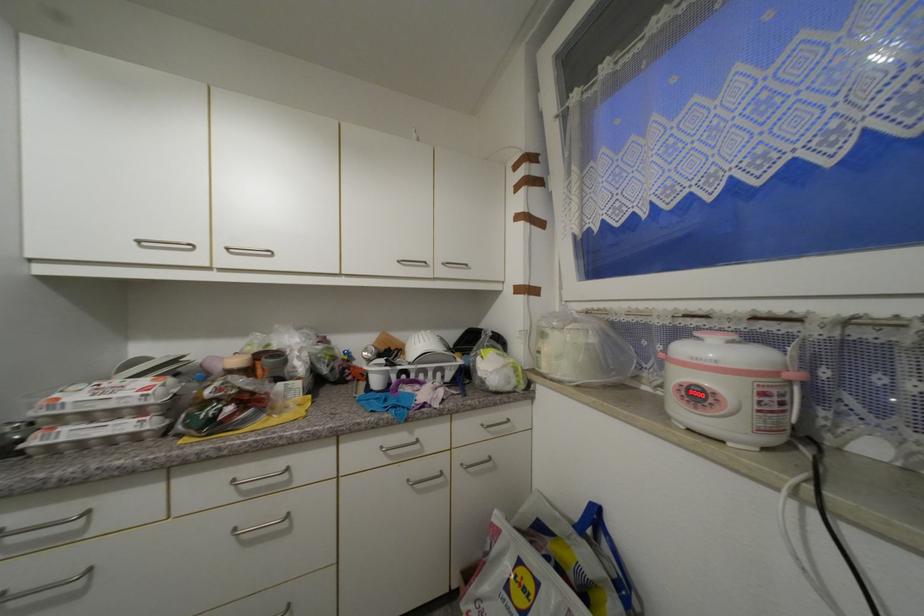
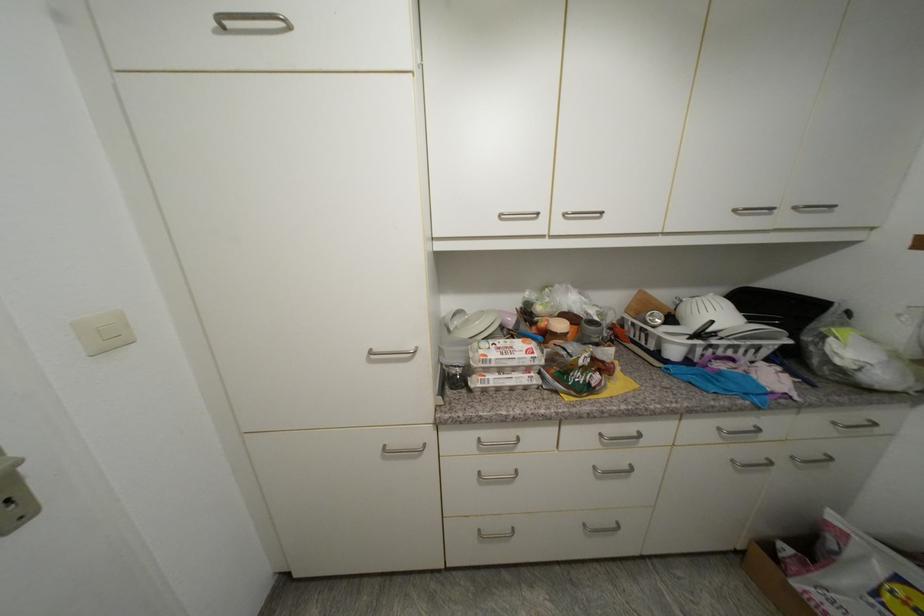
In the second image, find the point that corresponds to (x=234, y=251) in the first image.

(570, 216)